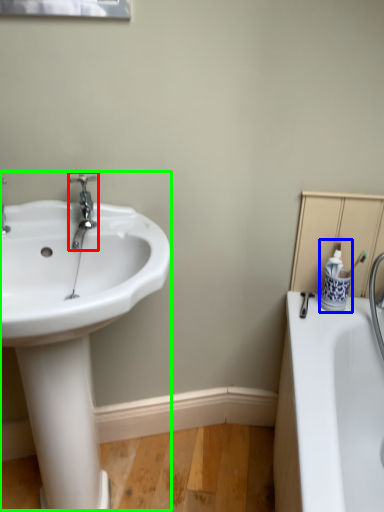
Question: Which is farther away from tap (highlighted by a red box)? toiletry (highlighted by a blue box) or sink (highlighted by a green box)?

Choices:
 (A) toiletry
 (B) sink

Answer: (A)